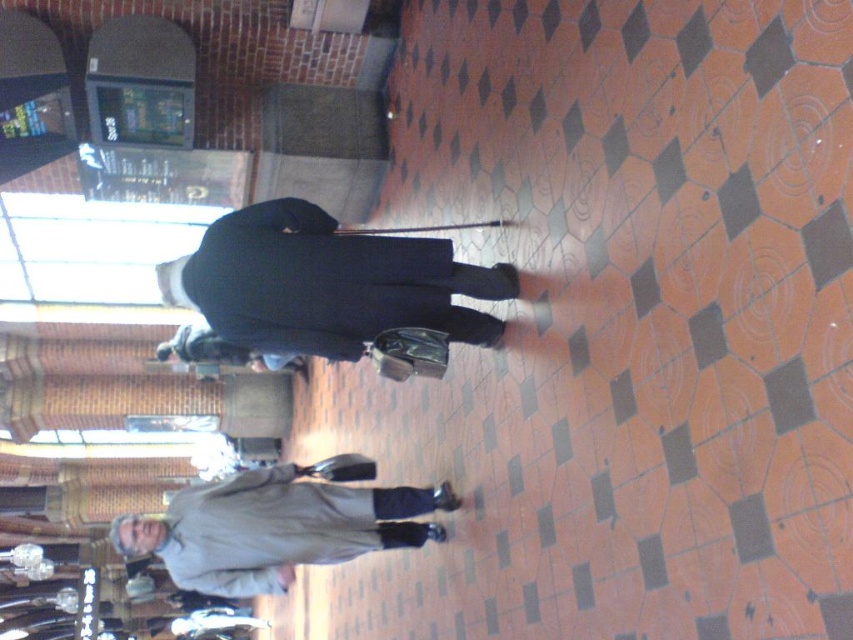
Based on the scene description, where is the dark wool coat at center located in terms of coordinates?

The dark wool coat at center is located at coordinates point (325, 284).

You are standing in this rotated indoor space and notice two coats hanging on a rack. The coats are the dark wool coat at center and the light gray fabric coat at lower center. Which coat is positioned to the right when facing the rack?

The dark wool coat at center is to the right of the light gray fabric coat at lower center.